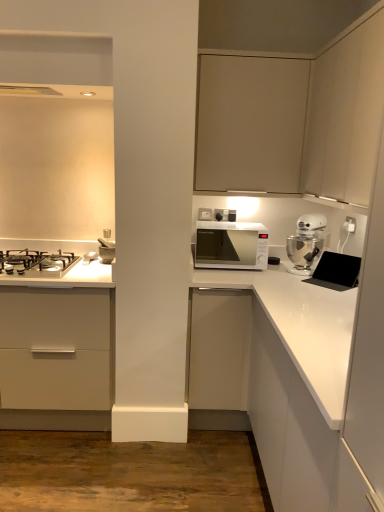
Question: Are white plastic electric outlet at upper right and matte beige cabinet at upper center, the third cabinetry from the top, located far from each other?

Choices:
 (A) yes
 (B) no

Answer: (B)

Question: From a real-world perspective, is white plastic electric outlet at upper right under matte beige cabinet at upper center, the third cabinetry from the top?

Choices:
 (A) no
 (B) yes

Answer: (B)

Question: Could you tell me if white plastic electric outlet at upper right is turned towards matte beige cabinet at upper center, the 3th cabinetry from the bottom?

Choices:
 (A) yes
 (B) no

Answer: (B)

Question: Is white plastic electric outlet at upper right looking in the opposite direction of matte beige cabinet at upper center, the 3th cabinetry from the bottom?

Choices:
 (A) yes
 (B) no

Answer: (B)

Question: Is the position of white plastic electric outlet at upper right less distant than that of matte beige cabinet at upper center, the 3th cabinetry from the bottom?

Choices:
 (A) yes
 (B) no

Answer: (B)

Question: From the image's perspective, is matte beige cabinet at upper center, the 1th cabinetry from the top, located above or below matte beige cabinet at upper center, the 3th cabinetry from the bottom?

Choices:
 (A) below
 (B) above

Answer: (B)

Question: Is point (238, 145) closer or farther from the camera than point (253, 178)?

Choices:
 (A) farther
 (B) closer

Answer: (B)

Question: In the image, is matte beige cabinet at upper center, the 1th cabinetry from the top, on the left side or the right side of matte beige cabinet at upper center, the 3th cabinetry from the bottom?

Choices:
 (A) right
 (B) left

Answer: (B)

Question: In the image, is matte beige cabinet at upper center, the fifth cabinetry positioned from the bottom, positioned in front of or behind matte beige cabinet at upper center, the 3th cabinetry from the bottom?

Choices:
 (A) behind
 (B) front

Answer: (A)

Question: Considering the positions of white glossy stand mixer at upper right and matte white exhaust hood at upper left in the image, is white glossy stand mixer at upper right bigger or smaller than matte white exhaust hood at upper left?

Choices:
 (A) small
 (B) big

Answer: (B)

Question: From the image's perspective, is white glossy stand mixer at upper right above or below matte white exhaust hood at upper left?

Choices:
 (A) below
 (B) above

Answer: (A)

Question: Considering the positions of point (304, 254) and point (109, 99), is point (304, 254) closer or farther from the camera than point (109, 99)?

Choices:
 (A) closer
 (B) farther

Answer: (B)

Question: In the image, is white glossy stand mixer at upper right positioned in front of or behind matte white exhaust hood at upper left?

Choices:
 (A) front
 (B) behind

Answer: (B)

Question: In the image, is matte beige cabinet at upper center, the fifth cabinetry positioned from the bottom, on the left side or the right side of matte beige cabinet at upper right, which appears as the fourth cabinetry when ordered from the bottom?

Choices:
 (A) right
 (B) left

Answer: (B)

Question: Choose the correct answer: Is matte beige cabinet at upper center, the 1th cabinetry from the top, inside matte beige cabinet at upper right, which appears as the fourth cabinetry when ordered from the bottom, or outside it?

Choices:
 (A) outside
 (B) inside

Answer: (A)